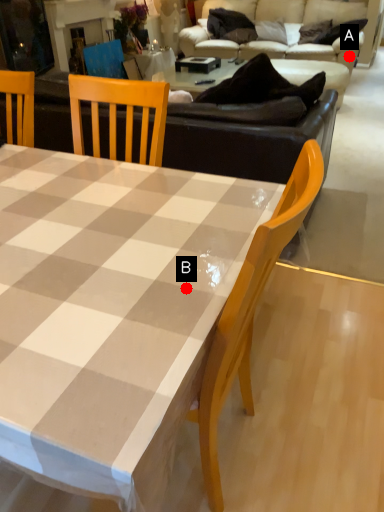
Question: Two points are circled on the image, labeled by A and B beside each circle. Which of the following is the farthest from the observer?

Choices:
 (A) A is further
 (B) B is further

Answer: (A)